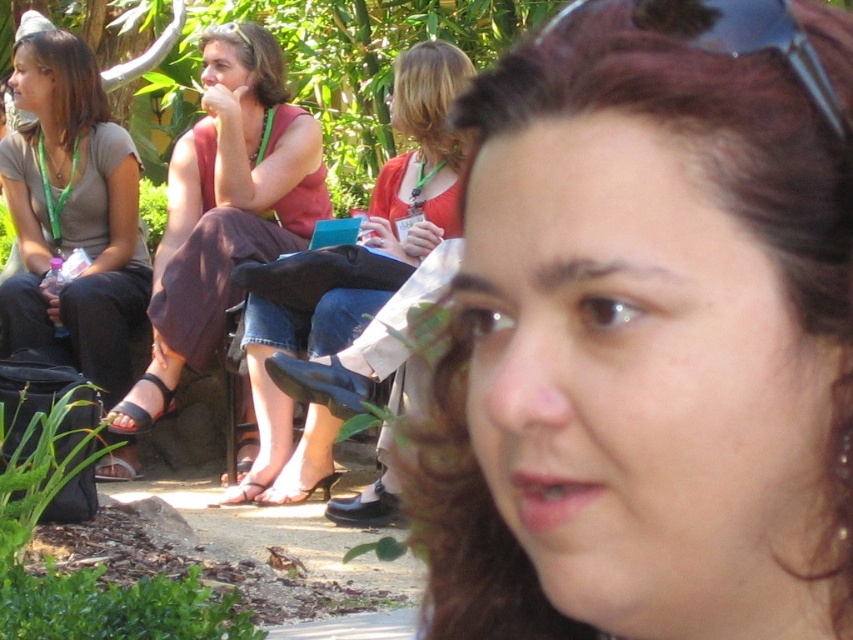
You are a photographer trying to capture a clear shot of the brown hair at center and the matte gray shirt at left. Based on the scene, which object is blocking your view of the other?

The brown hair at center is positioned under the matte gray shirt at left, so the matte gray shirt at left is blocking the view of the brown hair at center.

In the scene, where is the matte pink dress at center located in terms of coordinates?

The matte pink dress at center is located at coordinates point (225,209).

Looking at the image, where is the brown hair at center in relation to the transparent plastic goggles at upper center?

The brown hair at center is to the left of the transparent plastic goggles at upper center.